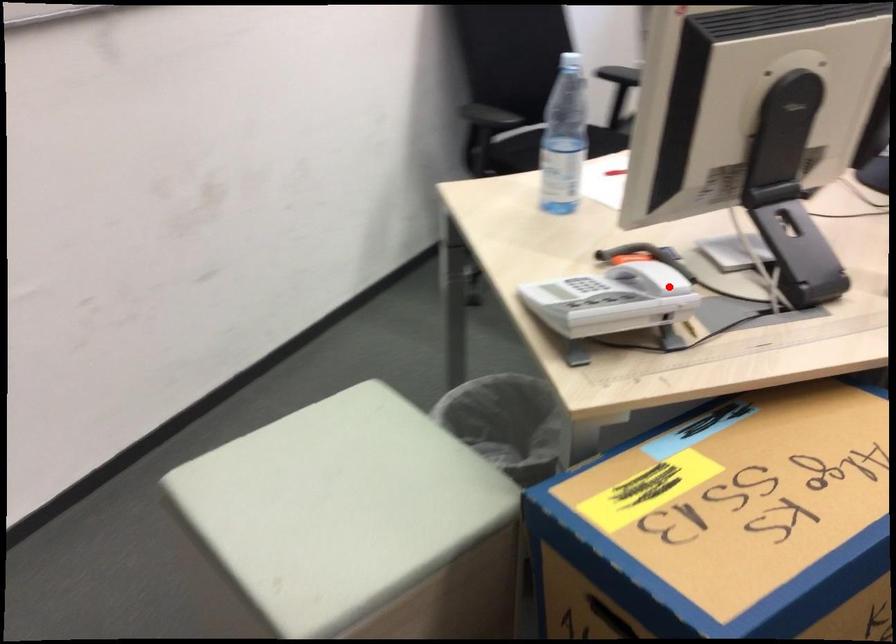
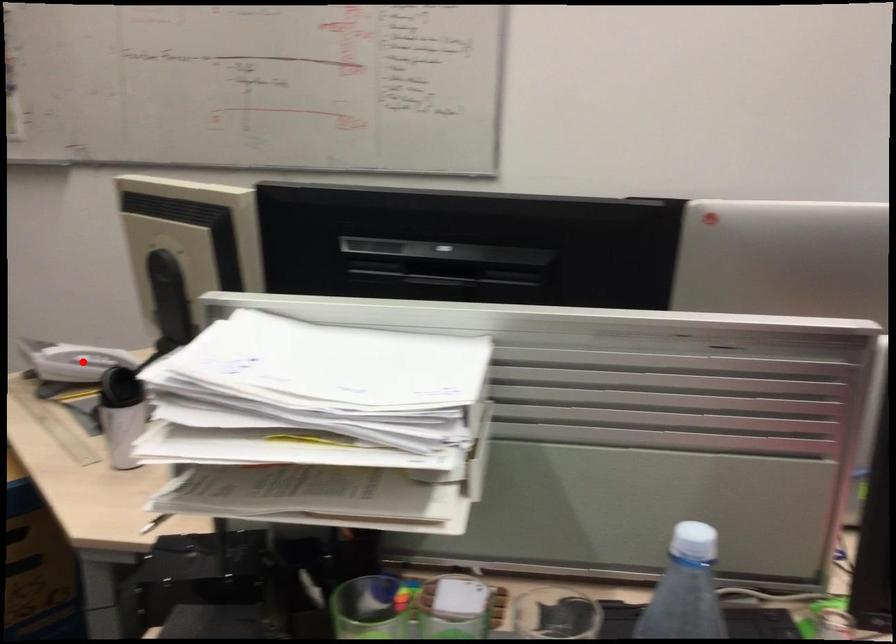
I am providing you with two images of the same scene from different viewpoints. A red point is marked on the first image and another point is marked on the second image. Is the marked point in image1 the same physical position as the marked point in image2?

No